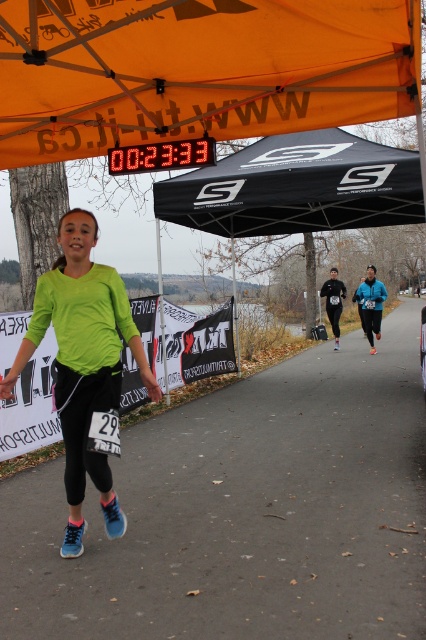
You are a participant in the race and you see the point marked at coordinates (296, 186). What object at that point is visible above you?

The black fabric canopy at upper center is located at the coordinates (296, 186), so the object visible above you at that point is the black fabric canopy at upper center.

You are a race organizer planning the route for the upcoming marathon. You need to place two checkpoints at the coordinates point (331, 141) and point (63, 541). Based on the scene provided, which checkpoint should be placed first along the race path?

Point (63, 541) should be placed first along the race path because point (331, 141) is behind it, meaning it comes later in the race route.

You are a photographer positioned at the starting line of the race. You want to take a photo of the black fabric tent at center without the blue mesh running shoe at lower left appearing in the foreground. Is this possible given their positions?

The blue mesh running shoe at lower left is behind the black fabric tent at center, so the tent will block the shoe from appearing in the foreground. Yes, you can take the photo without the shoe showing in front.